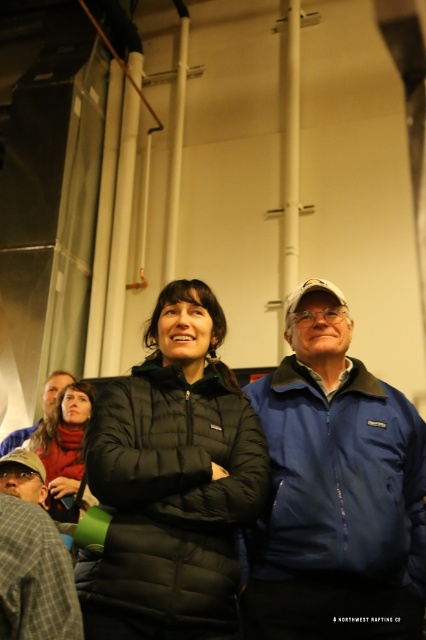
Who is more distant from viewer, (123, 448) or (69, 380)?

The point (69, 380) is more distant.

The image size is (426, 640). Identify the location of black puffer jacket at center. (169, 502).

Looking at this image, who is shorter, blue fleece jacket at center or black puffer jacket at center?

black puffer jacket at center

Is blue fleece jacket at center taller than black puffer jacket at center?

Yes, blue fleece jacket at center is taller than black puffer jacket at center.

Does point (261, 593) lie in front of point (184, 611)?

That is False.

Image resolution: width=426 pixels, height=640 pixels. Find the location of `blue fleece jacket at center`. blue fleece jacket at center is located at coordinates (336, 490).

Who is positioned more to the left, blue fleece jacket at center or plaid wool jacket at lower left?

From the viewer's perspective, plaid wool jacket at lower left appears more on the left side.

The height and width of the screenshot is (640, 426). What do you see at coordinates (336, 490) in the screenshot?
I see `blue fleece jacket at center` at bounding box center [336, 490].

Which is in front, point (388, 481) or point (40, 636)?

Point (40, 636)

Locate an element on the screen. blue fleece jacket at center is located at coordinates (336, 490).